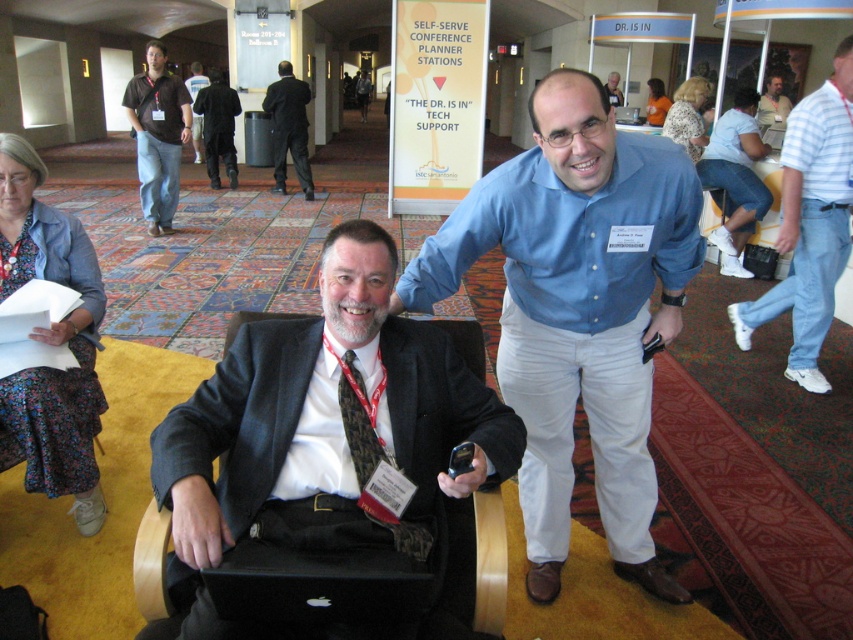
Question: Does blue cotton shirt at center lie in front of dark blue suit at center?

Choices:
 (A) no
 (B) yes

Answer: (B)

Question: Which object is farther from the camera taking this photo?

Choices:
 (A) blue cotton shirt at center
 (B) white denim jeans at lower right
 (C) light brown leather jacket at upper center

Answer: (C)

Question: Observing the image, what is the correct spatial positioning of floral fabric skirt at lower left in reference to white cotton shirt at upper right?

Choices:
 (A) right
 (B) left

Answer: (B)

Question: Considering the real-world distances, which object is closest to the floral fabric skirt at lower left?

Choices:
 (A) matte black suit at center
 (B) denim jeans at center
 (C) white cotton shirt at upper right
 (D) light brown leather jacket at upper center

Answer: (A)

Question: Can you confirm if white denim jeans at lower right is positioned to the right of light brown leather jacket at upper center?

Choices:
 (A) yes
 (B) no

Answer: (B)

Question: Which object appears farthest from the camera in this image?

Choices:
 (A) denim jeans at center
 (B) orange shirt at upper center
 (C) dark blue shirt at center
 (D) floral fabric skirt at lower left

Answer: (C)